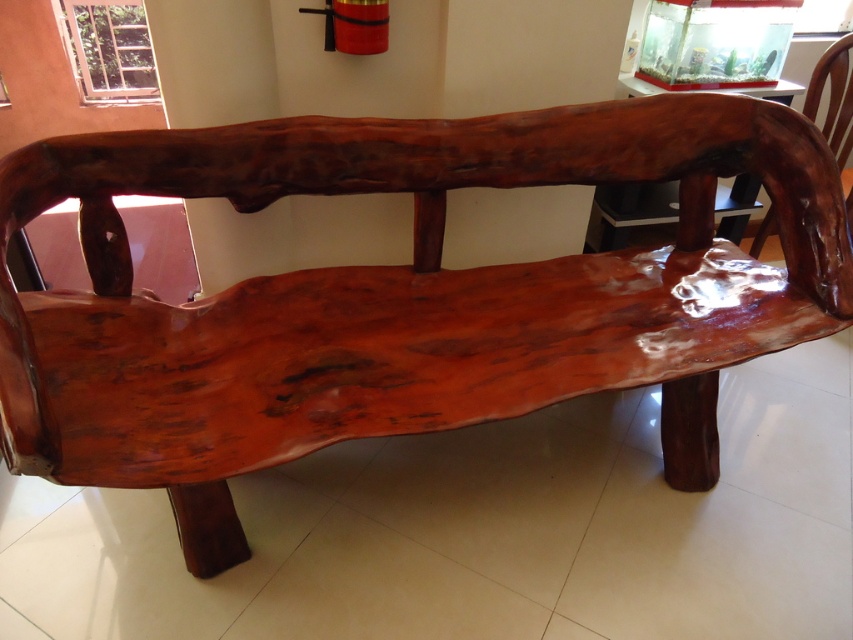
Who is positioned more to the right, glossy wood table at upper center or glossy wood chair at upper right?

glossy wood chair at upper right

Who is positioned more to the left, glossy wood table at upper center or glossy wood chair at upper right?

glossy wood table at upper center

Where is `glossy wood table at upper center`? This screenshot has width=853, height=640. glossy wood table at upper center is located at coordinates (630, 211).